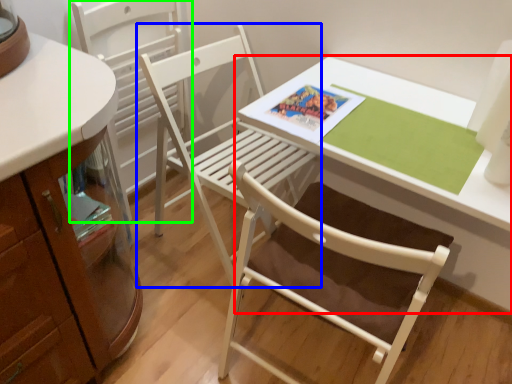
Question: Based on their relative distances, which object is nearer to table (highlighted by a red box)? Choose from chair (highlighted by a blue box) and chair (highlighted by a green box).

Choices:
 (A) chair
 (B) chair

Answer: (A)